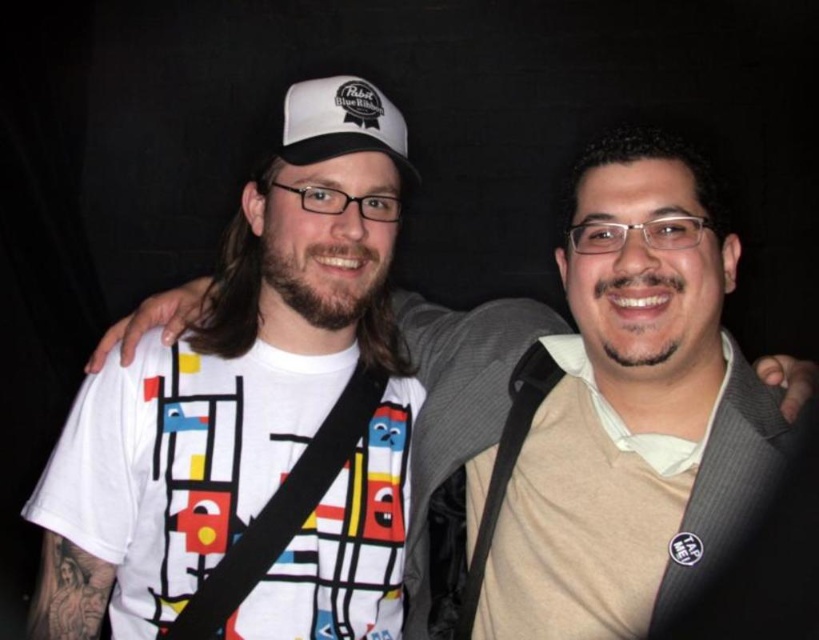
Question: Does black fabric strap at center have a larger size compared to white fabric cap at center?

Choices:
 (A) no
 (B) yes

Answer: (B)

Question: Based on their relative distances, which object is farther from the black fabric strap at upper center?

Choices:
 (A) black fabric strap at center
 (B) white matte t-shirt at center

Answer: (A)

Question: Which point appears farthest from the camera in this image?

Choices:
 (A) (711, 269)
 (B) (311, 496)

Answer: (B)

Question: Is black fabric strap at center positioned before white fabric cap at center?

Choices:
 (A) yes
 (B) no

Answer: (A)

Question: Which object is farther from the camera taking this photo?

Choices:
 (A) black fabric strap at upper center
 (B) white fabric cap at center
 (C) white matte t-shirt at center
 (D) black fabric strap at center

Answer: (A)

Question: Is white matte t-shirt at center thinner than black fabric strap at center?

Choices:
 (A) no
 (B) yes

Answer: (A)